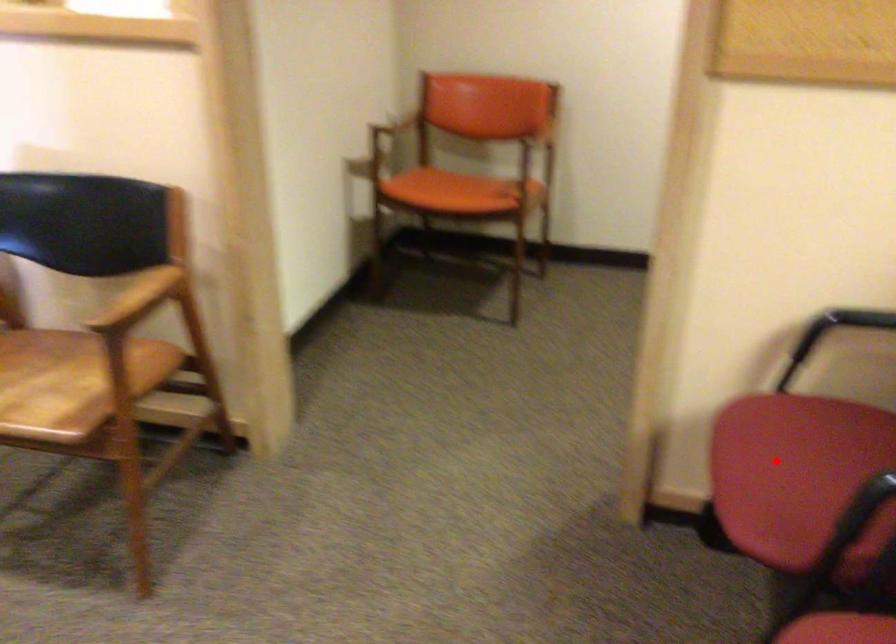
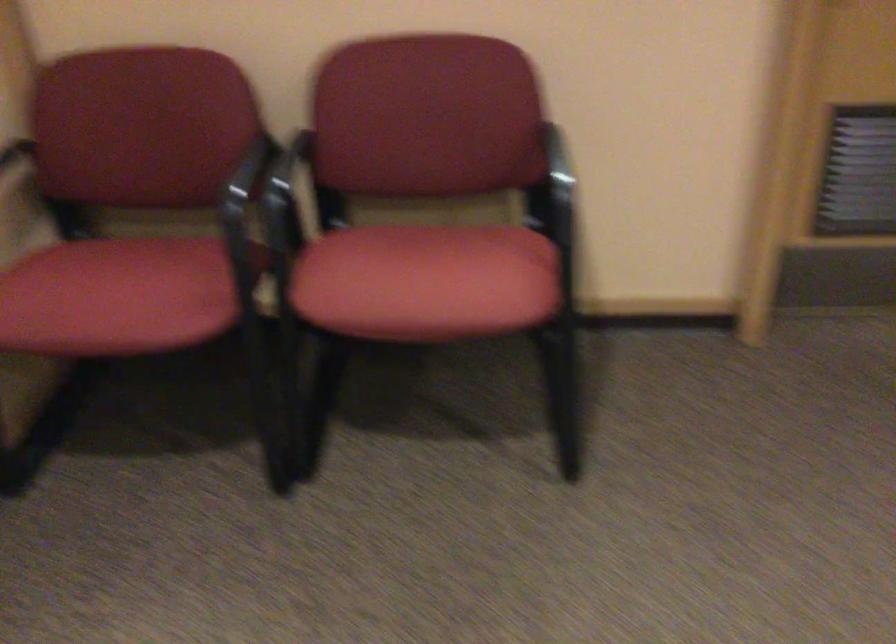
Question: I am providing you with two images of the same scene from different viewpoints. A red point is shown in image1. For the corresponding object point in image2, is it positioned nearer or farther from the camera?

Choices:
 (A) Nearer
 (B) Farther

Answer: (B)